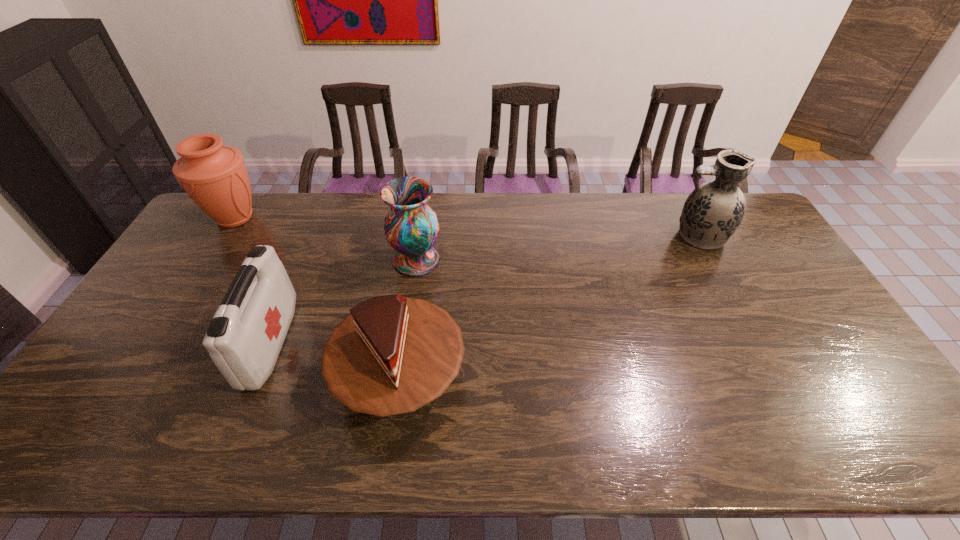
Select which object appears as the closest to the first-aid kit. Please provide its 2D coordinates. Your answer should be formatted as a tuple, i.e. [(x, y)], where the tuple contains the x and y coordinates of a point satisfying the conditions above.

[(393, 354)]

In order to click on the second closest vase to the leftmost vase in this screenshot , I will do `click(713, 211)`.

I want to click on vase that stands as the closest to the first-aid kit, so click(x=411, y=227).

Identify the location of vacant area in the image that satisfies the following two spatial constraints: 1. on the front side of the second vase from left to right; 2. on the right side of the cake. The width and height of the screenshot is (960, 540). (399, 379).

The height and width of the screenshot is (540, 960). I want to click on vacant space that satisfies the following two spatial constraints: 1. on the front side of the cake; 2. on the left side of the second object from left to right, so 256,379.